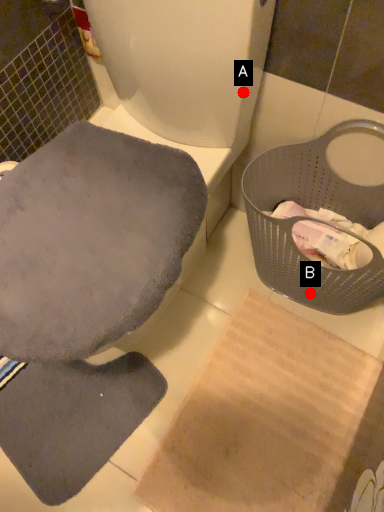
Question: Two points are circled on the image, labeled by A and B beside each circle. Among these points, which one is farthest from the camera?

Choices:
 (A) A is further
 (B) B is further

Answer: (B)